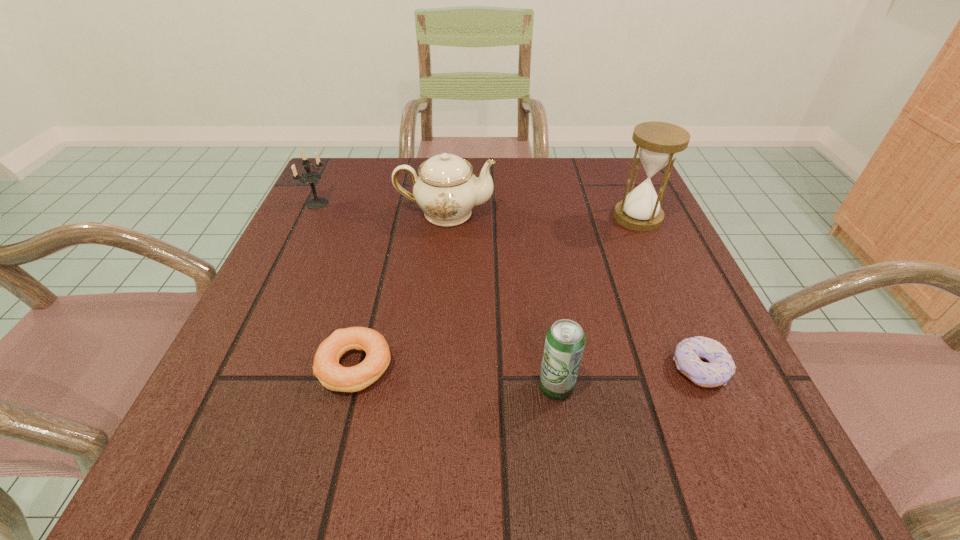
In order to click on the tallest object in this screenshot , I will do [x=657, y=143].

Locate an element on the screen. chinaware is located at coordinates (446, 189).

Find the location of a particular element. The image size is (960, 540). candle holder is located at coordinates (309, 176).

Locate an element on the screen. The image size is (960, 540). beer can is located at coordinates (565, 340).

Identify the location of bagel. This screenshot has width=960, height=540. (332, 375).

Identify the location of doughnut. (720, 367).

Find the location of `free location located 0.370m on the front of the tallest object`. free location located 0.370m on the front of the tallest object is located at coordinates (712, 384).

Locate an element on the screen. The image size is (960, 540). vacant area situated at the spout of the chinaware is located at coordinates (572, 213).

This screenshot has width=960, height=540. I want to click on vacant area located 0.400m on the front of the candle holder, so click(241, 363).

Locate an element on the screen. The width and height of the screenshot is (960, 540). vacant space situated 0.210m on the left of the beer can is located at coordinates (395, 387).